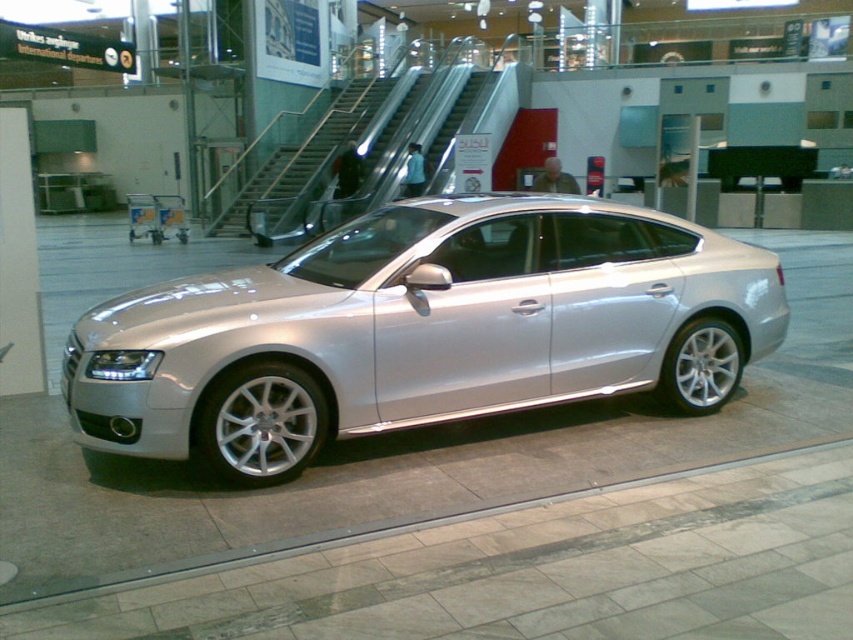
Question: Does silver metallic car at center have a larger size compared to metallic silver escalator at center?

Choices:
 (A) no
 (B) yes

Answer: (A)

Question: Which point appears farthest from the camera in this image?

Choices:
 (A) (277, 408)
 (B) (387, 184)

Answer: (B)

Question: Considering the relative positions of silver metallic car at center and metallic silver escalator at center in the image provided, where is silver metallic car at center located with respect to metallic silver escalator at center?

Choices:
 (A) left
 (B) right

Answer: (B)

Question: Which point is farther from the camera taking this photo?

Choices:
 (A) (503, 296)
 (B) (254, 237)

Answer: (B)

Question: Which object appears farthest from the camera in this image?

Choices:
 (A) silver metallic car at center
 (B) metallic silver escalator at center

Answer: (B)

Question: Is silver metallic car at center smaller than metallic silver escalator at center?

Choices:
 (A) no
 (B) yes

Answer: (B)